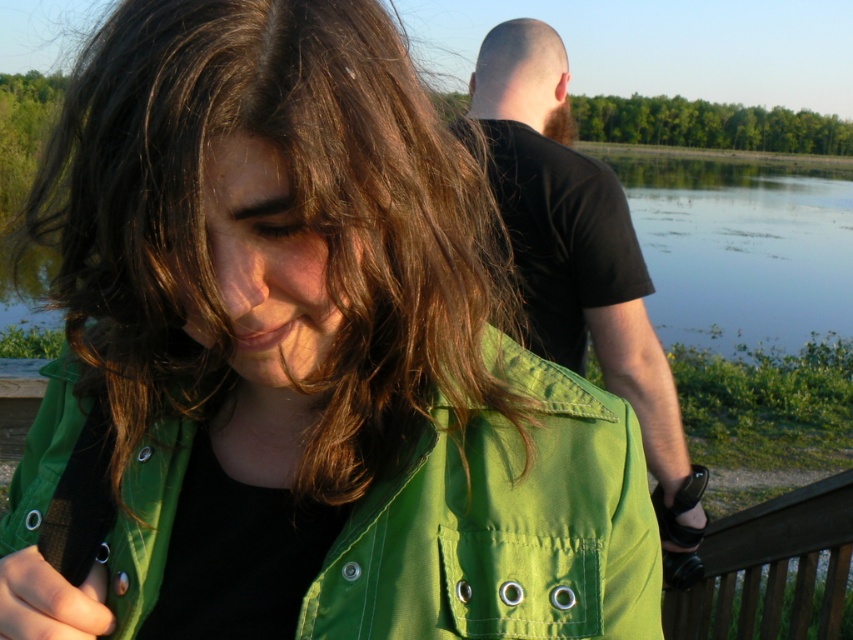
Question: Is black cotton t-shirt at upper right to the left of brown wooden rail at lower right from the viewer's perspective?

Choices:
 (A) yes
 (B) no

Answer: (A)

Question: Which point is farther to the camera?

Choices:
 (A) (746, 536)
 (B) (659, 164)
 (C) (631, 323)

Answer: (B)

Question: Which point appears closest to the camera in this image?

Choices:
 (A) (601, 296)
 (B) (740, 184)
 (C) (753, 557)

Answer: (C)

Question: Does black cotton t-shirt at upper right lie behind brown wooden rail at lower right?

Choices:
 (A) yes
 (B) no

Answer: (B)

Question: Which object is the farthest from the brown wooden rail at lower right?

Choices:
 (A) clear water at lake right
 (B) black cotton t-shirt at upper right

Answer: (A)

Question: Does black cotton t-shirt at upper right come in front of clear water at lake right?

Choices:
 (A) yes
 (B) no

Answer: (A)